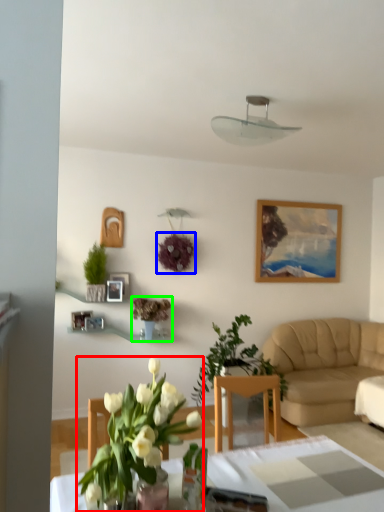
Question: Considering the real-world distances, which object is farthest from houseplant (highlighted by a red box)? flower (highlighted by a blue box) or houseplant (highlighted by a green box)?

Choices:
 (A) flower
 (B) houseplant

Answer: (A)